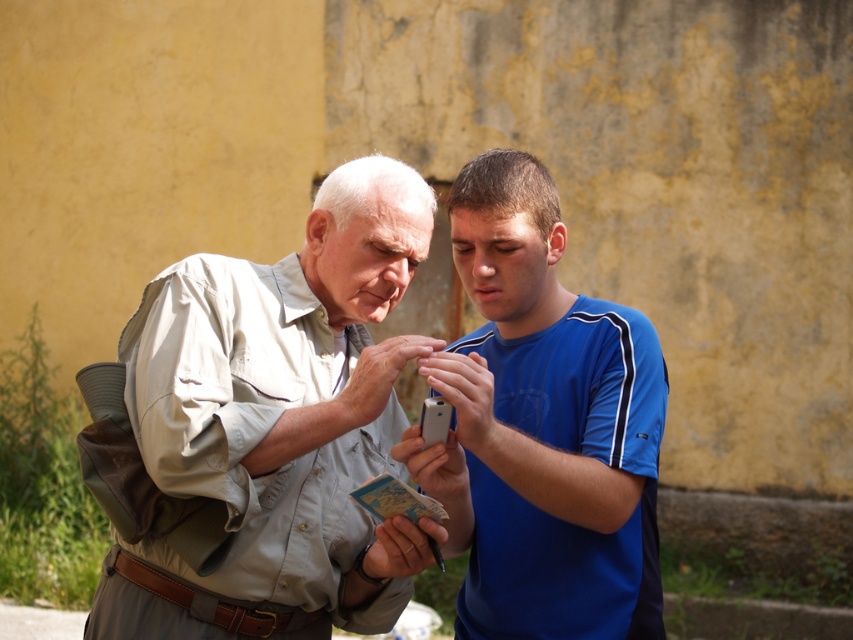
Can you confirm if light beige shirt at center is positioned above blue smooth shirt at center?

No, light beige shirt at center is not above blue smooth shirt at center.

Is light beige shirt at center positioned in front of blue smooth shirt at center?

That is False.

Who is more forward, [126,358] or [659,353]?

Point [126,358] is more forward.

Identify the location of light beige shirt at center. (277, 424).